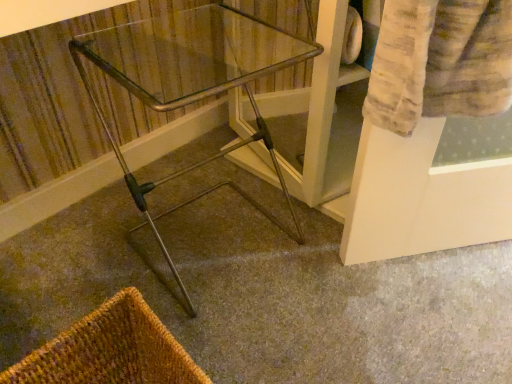
Where is `vacant area that lies in front of clear glass table at center`? This screenshot has width=512, height=384. vacant area that lies in front of clear glass table at center is located at coordinates (256, 332).